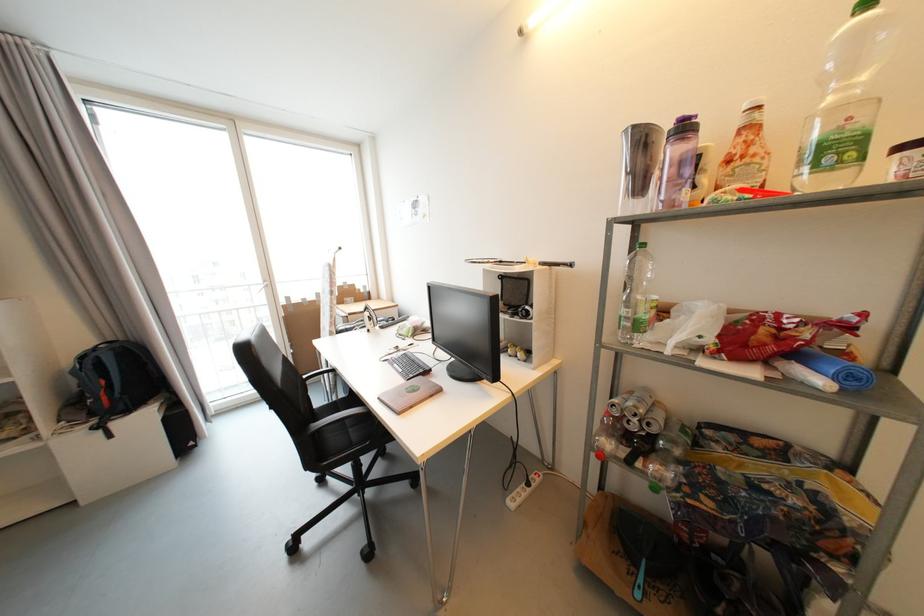
What do you see at coordinates (342, 424) in the screenshot? This screenshot has height=616, width=924. I see `the chair sitting surface` at bounding box center [342, 424].